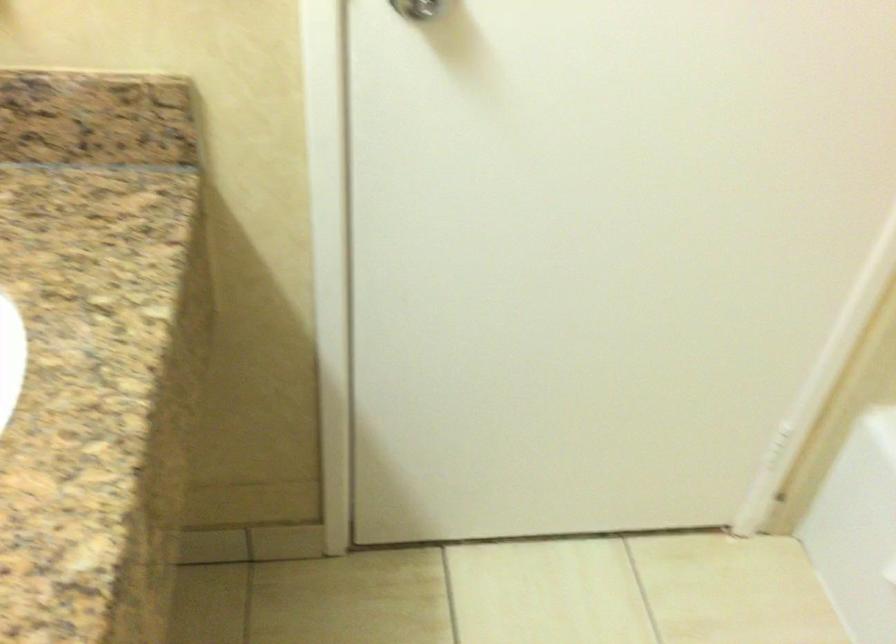
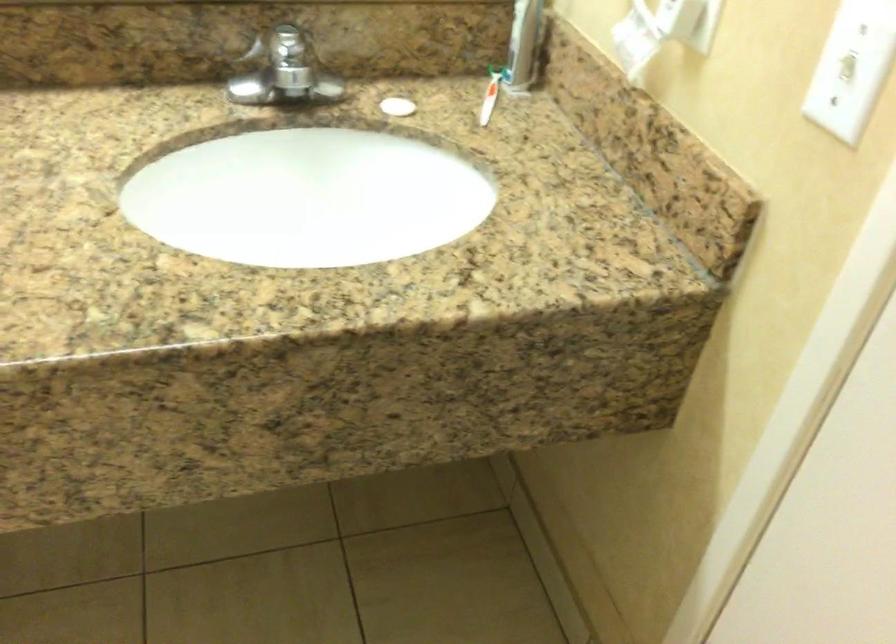
The images are taken continuously from a first-person perspective. In which direction is your viewpoint rotating?

The rotation direction of the camera is left-down.